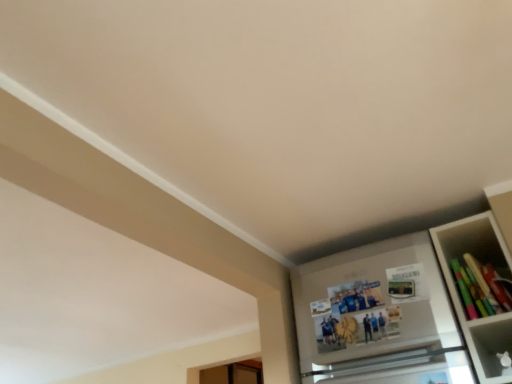
What are the coordinates of `white glossy cabinet at upper center` in the screenshot? It's located at (x=378, y=317).

Image resolution: width=512 pixels, height=384 pixels. What do you see at coordinates (378, 317) in the screenshot? I see `white glossy cabinet at upper center` at bounding box center [378, 317].

You are a GUI agent. You are given a task and a screenshot of the screen. Output one action in this format:
    pyautogui.click(x=<x>, y=<y>)
    Task: Click on the white glossy cabinet at upper center
    The height and width of the screenshot is (384, 512).
    Given the screenshot: What is the action you would take?
    pyautogui.click(x=378, y=317)